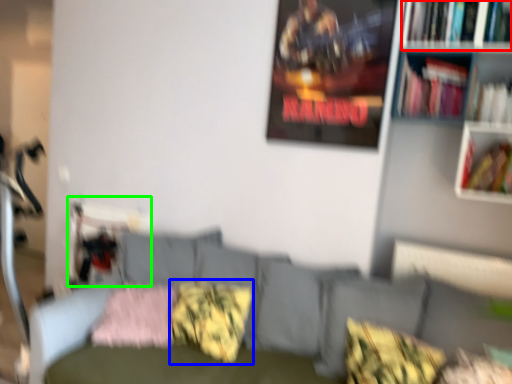
Question: Which is farther away from book (highlighted by a red box)? pillow (highlighted by a blue box) or swivel chair (highlighted by a green box)?

Choices:
 (A) pillow
 (B) swivel chair

Answer: (B)